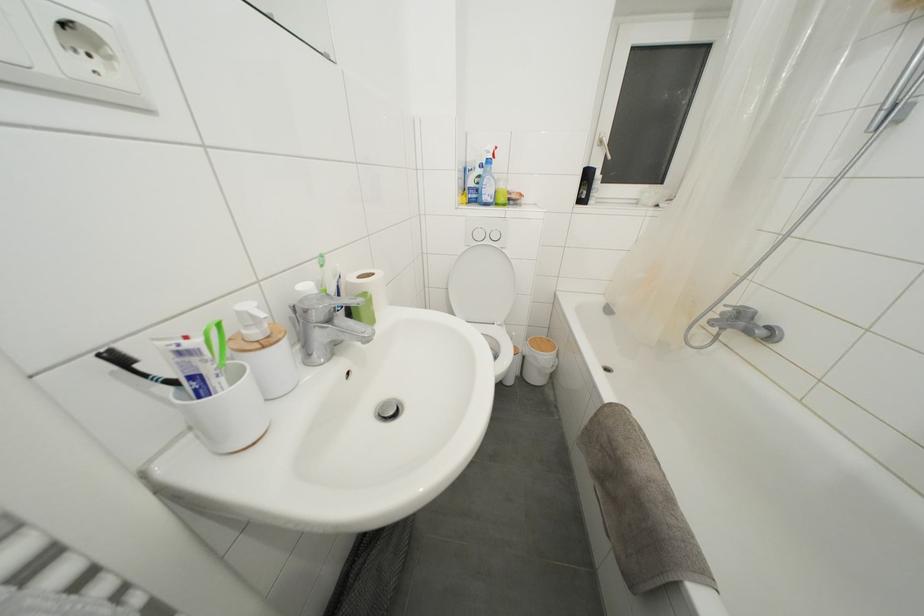
Image resolution: width=924 pixels, height=616 pixels. In order to click on green toothbrush in this screenshot , I will do `click(215, 342)`.